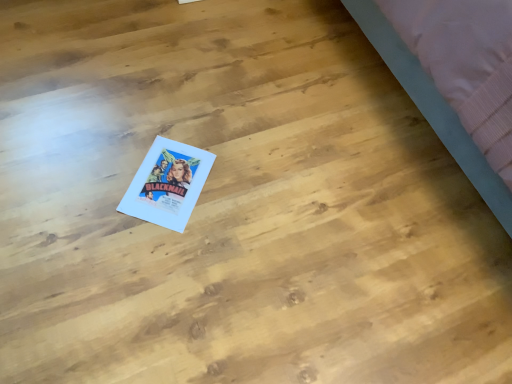
Where is `vacant region under white paper at center (from a real-world perspective)`? The height and width of the screenshot is (384, 512). vacant region under white paper at center (from a real-world perspective) is located at coordinates (168, 180).